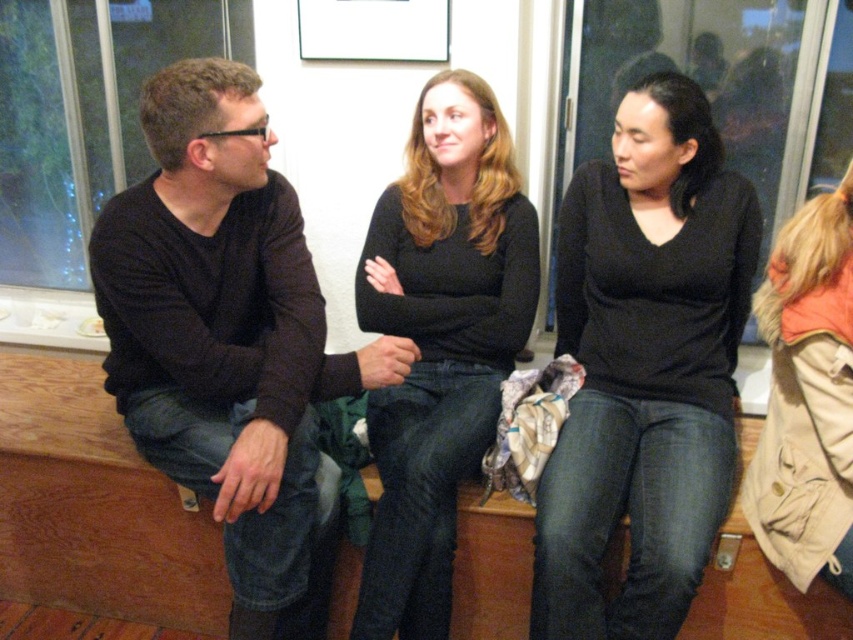
Question: Can you confirm if black matte sweater at left is positioned to the right of matte black shirt at center?

Choices:
 (A) no
 (B) yes

Answer: (A)

Question: Among these points, which one is farthest from the camera?

Choices:
 (A) (440, 97)
 (B) (635, 442)
 (C) (331, 502)

Answer: (A)

Question: Does black matte sweater at left lie behind matte black shirt at center?

Choices:
 (A) no
 (B) yes

Answer: (A)

Question: Which object appears closest to the camera in this image?

Choices:
 (A) black matte shirt at center
 (B) matte black shirt at center

Answer: (A)

Question: Which object appears farthest from the camera in this image?

Choices:
 (A) black matte sweater at left
 (B) black matte shirt at center
 (C) matte black shirt at center

Answer: (C)

Question: Observing the image, what is the correct spatial positioning of black matte sweater at left in reference to black matte shirt at center?

Choices:
 (A) below
 (B) above

Answer: (A)